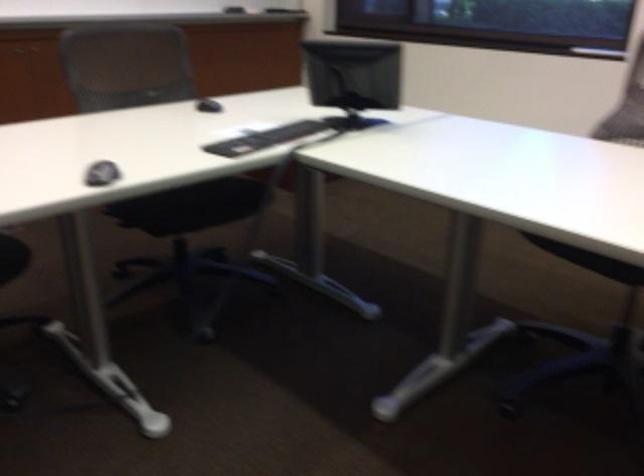
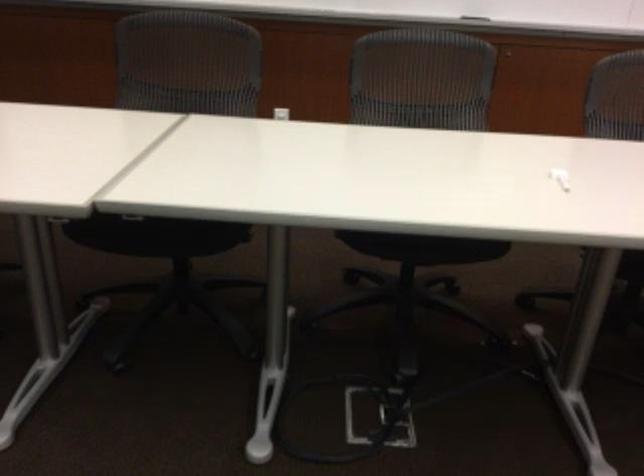
Question: How did the camera likely rotate?

Choices:
 (A) Left
 (B) Right
 (C) Up
 (D) Down

Answer: (A)